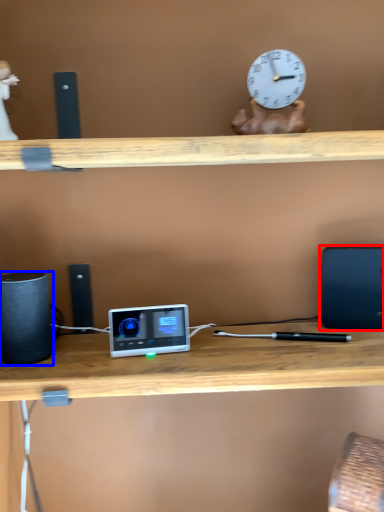
Question: Which object appears farthest to the camera in this image, laptop (highlighted by a red box) or speaker (highlighted by a blue box)?

Choices:
 (A) laptop
 (B) speaker

Answer: (A)